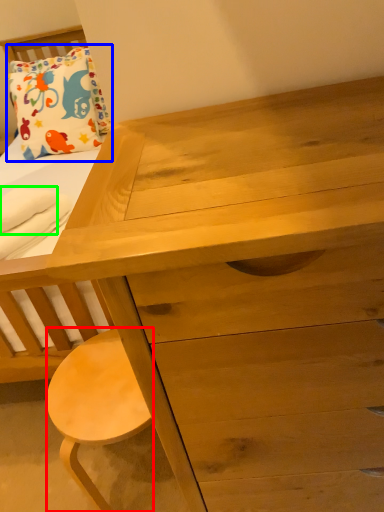
Question: Which is farther away from stool (highlighted by a red box)? pillow (highlighted by a blue box) or cloth (highlighted by a green box)?

Choices:
 (A) pillow
 (B) cloth

Answer: (A)